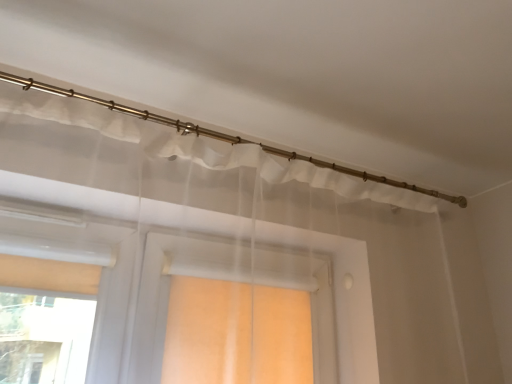
Question: Should I look upward or downward to see sheer white curtain at upper center?

Choices:
 (A) up
 (B) down

Answer: (A)